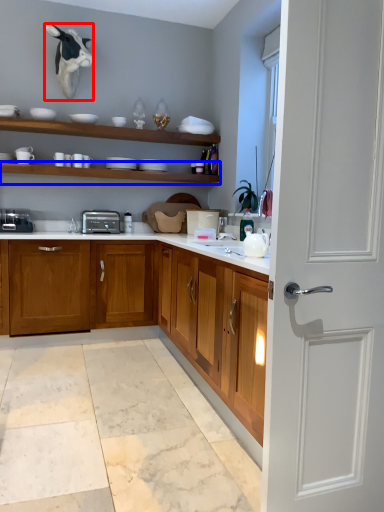
Question: Among these objects, which one is farthest to the camera, animal (highlighted by a red box) or shelf (highlighted by a blue box)?

Choices:
 (A) animal
 (B) shelf

Answer: (B)